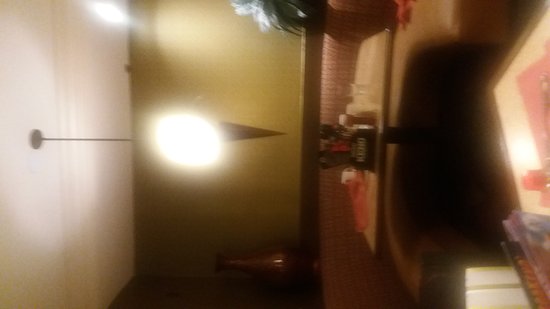
The width and height of the screenshot is (550, 309). What are the coordinates of `ceiling light` in the screenshot? It's located at (196, 140), (113, 11).